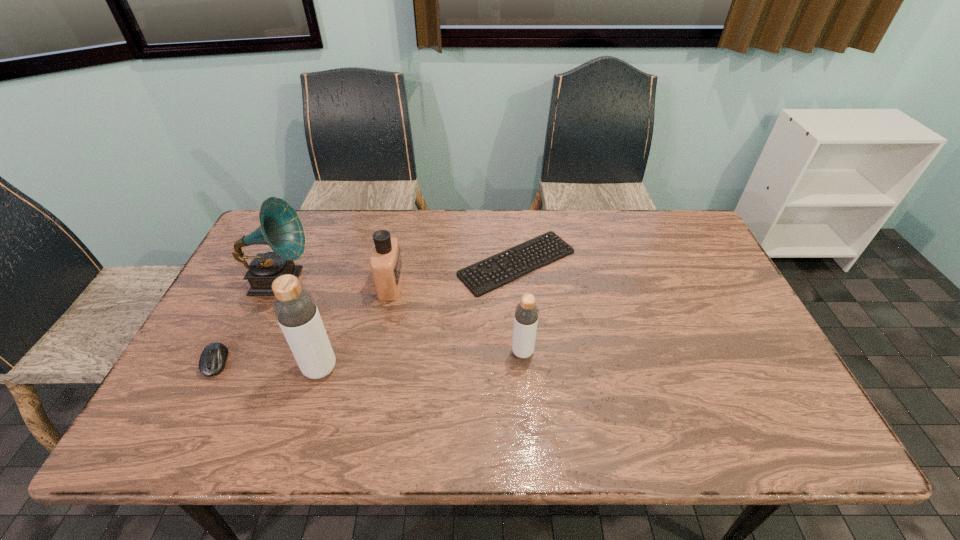
Observe the arrangement of all bottles in the image. To keep them evenly spaced, where would you place another bottle on the right? Please locate a free space. Please provide its 2D coordinates. Your answer should be formatted as a tuple, i.e. [(x, y)], where the tuple contains the x and y coordinates of a point satisfying the conditions above.

[(712, 336)]